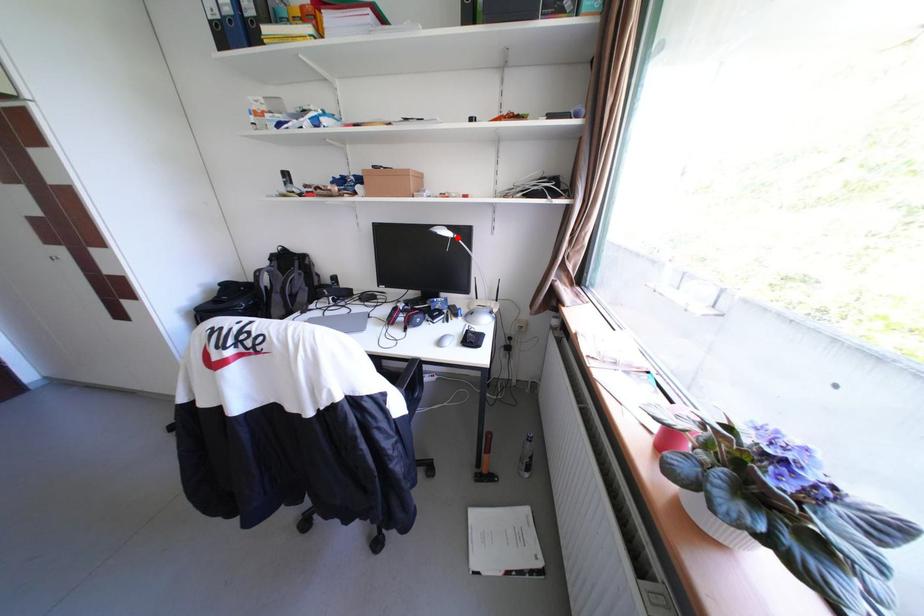
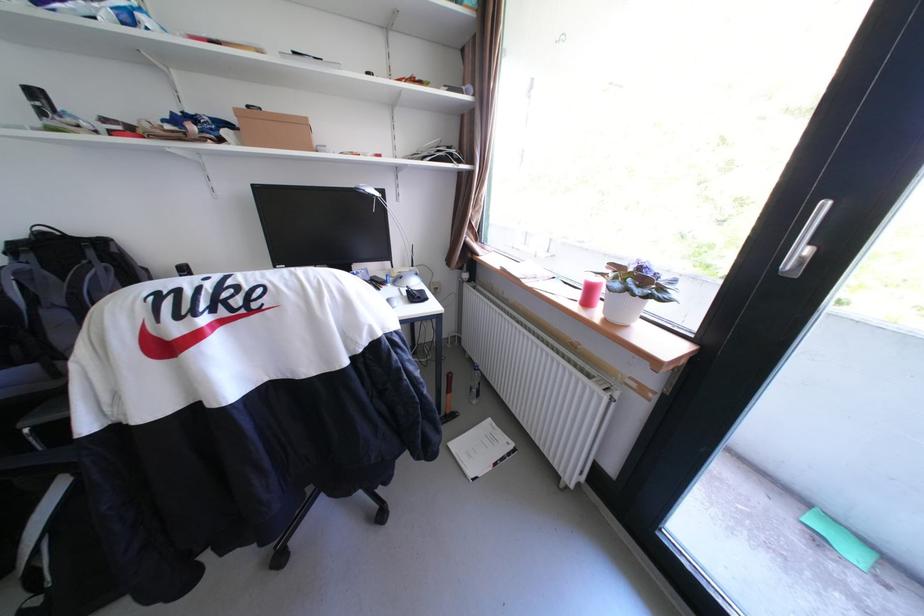
Where in the second image is the point corresponding to the highlighted location from the first image?

(382, 198)